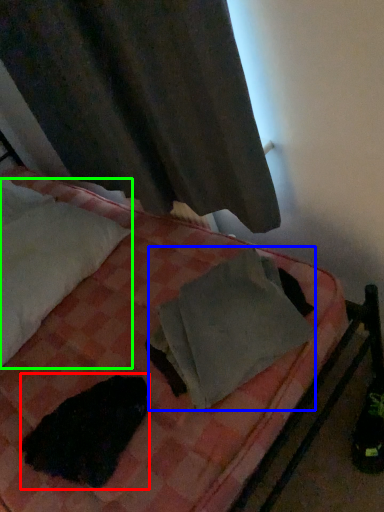
Question: Considering the real-world distances, which object is closest to animal (highlighted by a red box)? material (highlighted by a blue box) or pillow (highlighted by a green box).

Choices:
 (A) material
 (B) pillow

Answer: (A)